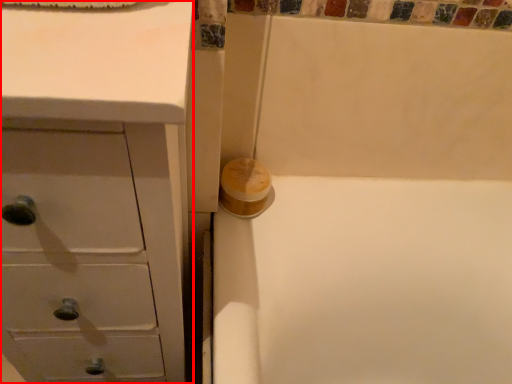
Question: Considering the relative positions of chest of drawers (annotated by the red box) and toilet paper in the image provided, where is chest of drawers (annotated by the red box) located with respect to the staircase?

Choices:
 (A) right
 (B) left

Answer: (B)